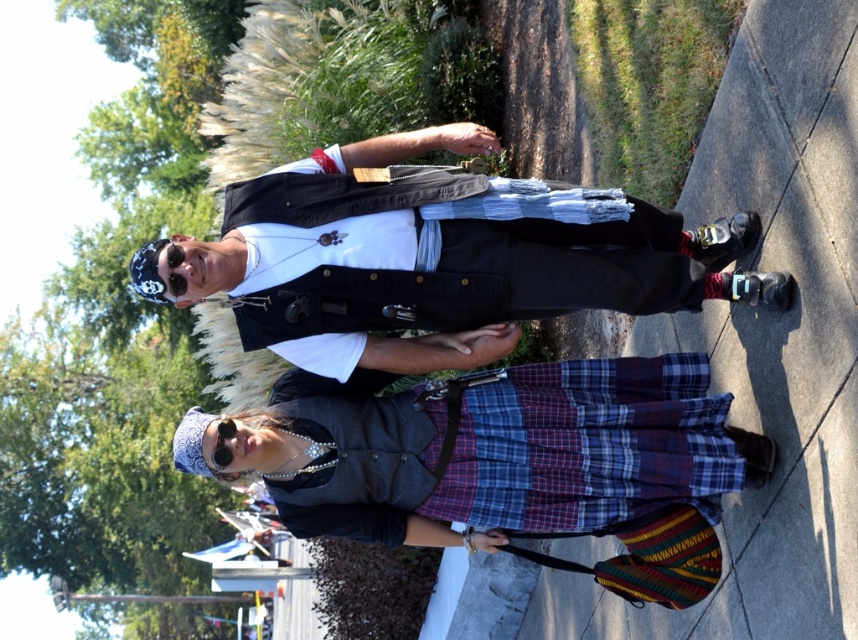
Is point (180, 289) less distant than point (491, 428)?

Yes, it is.

What do you see at coordinates (437, 259) in the screenshot? I see `matte black vest at center` at bounding box center [437, 259].

Is point (257, 288) in front of point (289, 388)?

Yes.

You are a GUI agent. You are given a task and a screenshot of the screen. Output one action in this format:
    pyautogui.click(x=<x>, y=<y>)
    Task: Click on the matte black vest at center
    
    Given the screenshot: What is the action you would take?
    pyautogui.click(x=437, y=259)